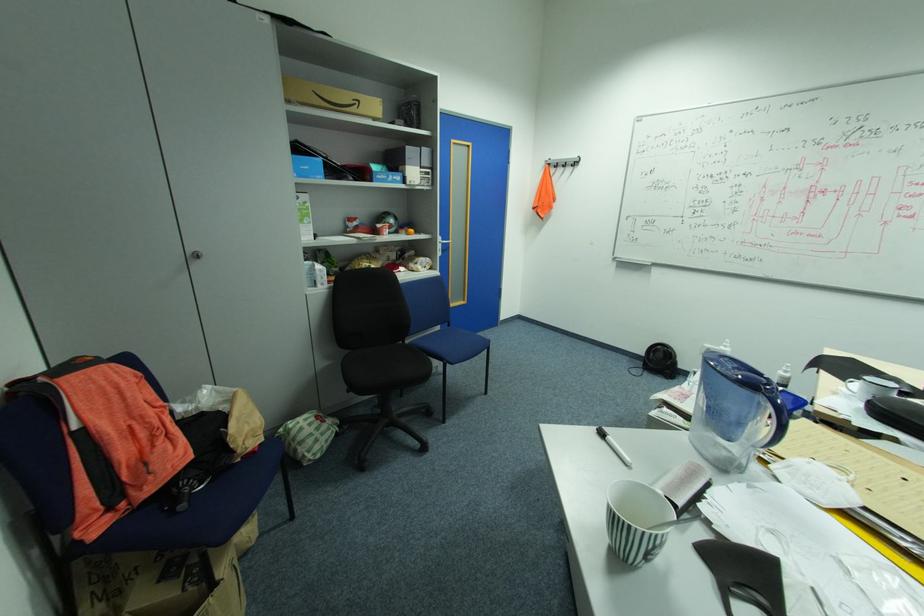
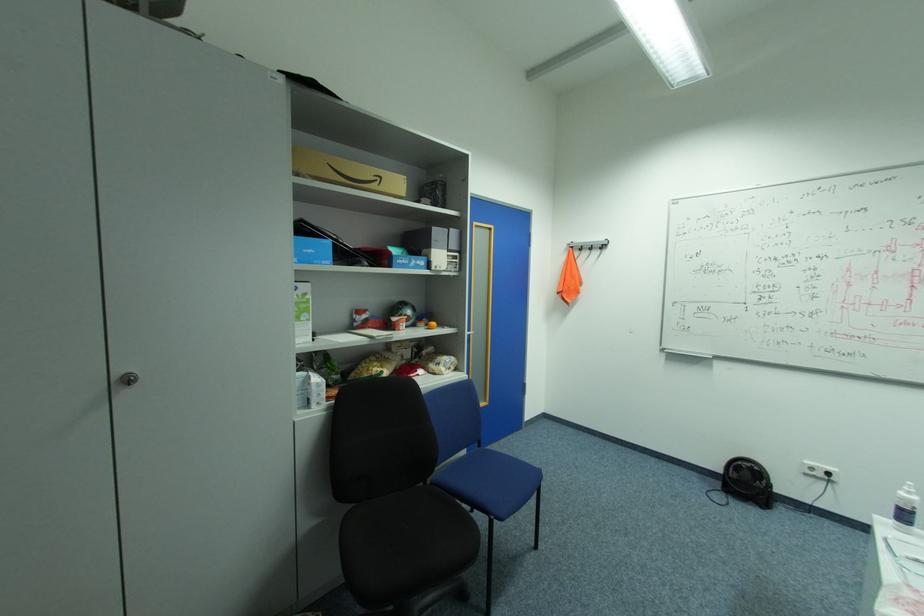
In the second image, find the point that corresponds to the point at 555,164 in the first image.

(578, 246)